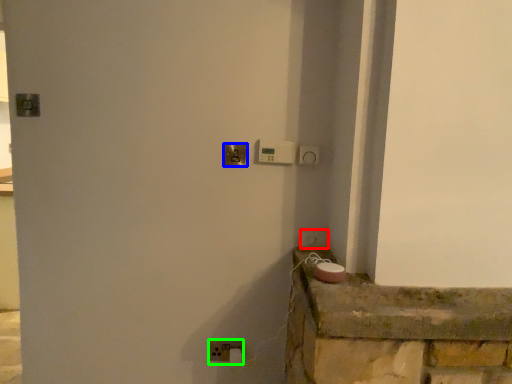
Question: Estimate the real-world distances between objects in this image. Which object is farther from light switch (highlighted by a red box), door handle (highlighted by a blue box) or light switch (highlighted by a green box)?

Choices:
 (A) door handle
 (B) light switch

Answer: (B)